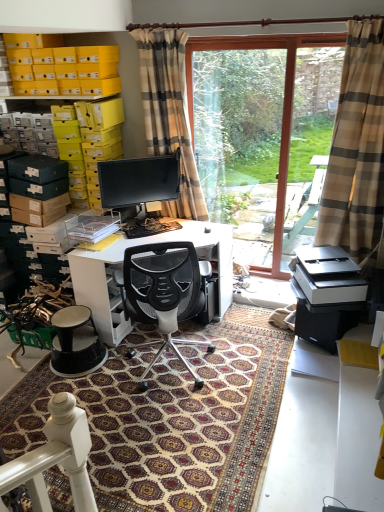
Locate an element on the screen. Image resolution: width=384 pixels, height=512 pixels. unoccupied area in front of black mesh office chair at center is located at coordinates (145, 423).